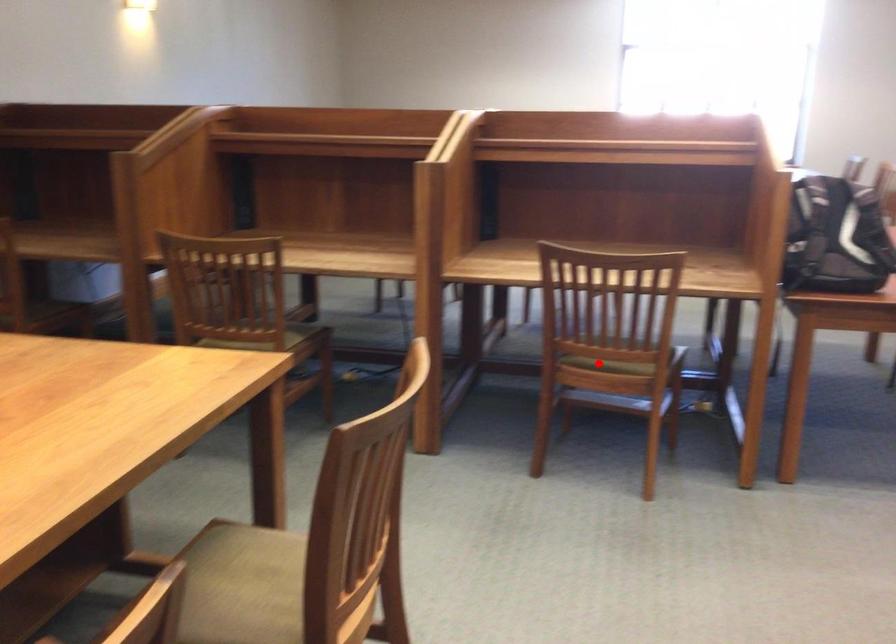
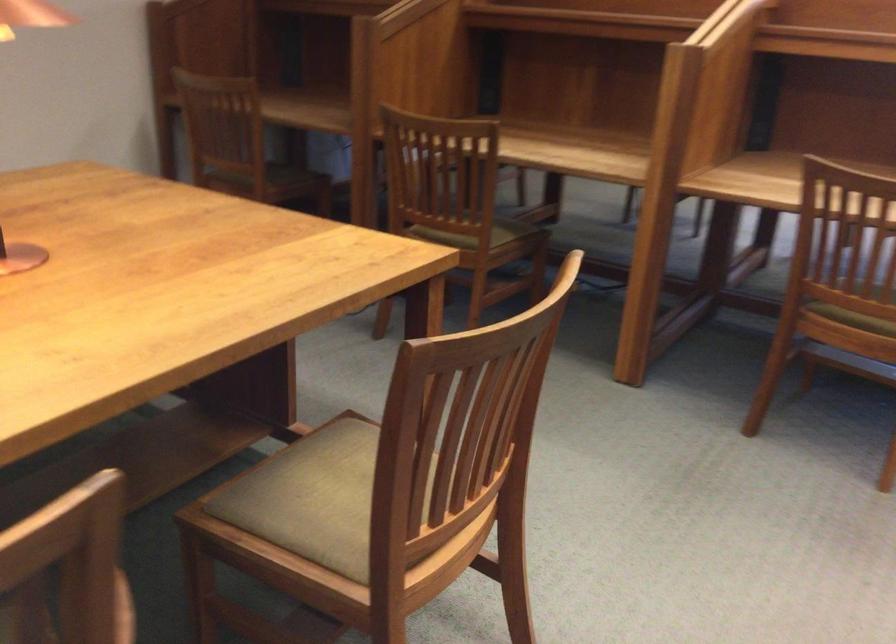
Question: I am providing you with two images of the same scene from different viewpoints. Given a red point in image1, look at the same physical point in image2. Is it:

Choices:
 (A) Closer to the viewpoint
 (B) Farther from the viewpoint

Answer: (A)